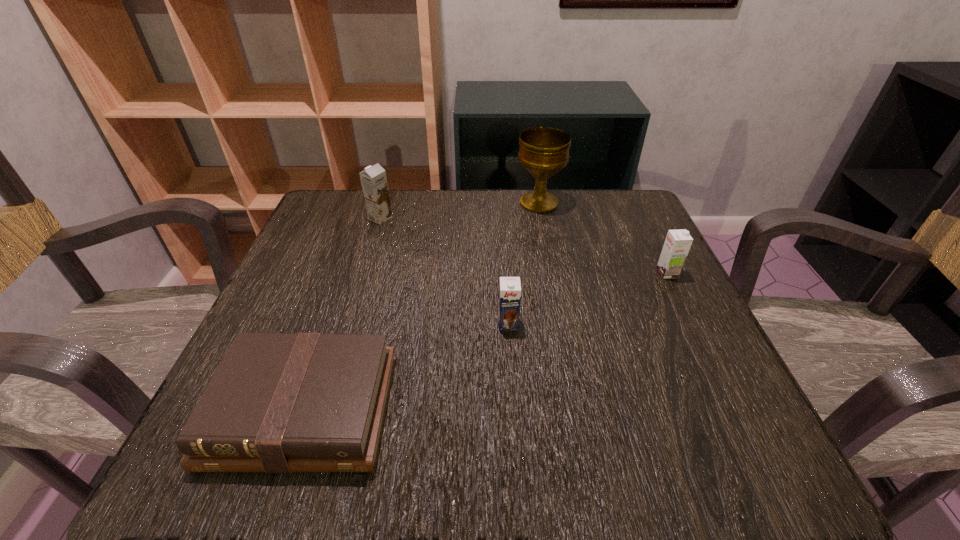
Image resolution: width=960 pixels, height=540 pixels. Identify the location of vacant area between the nearest chocolate milk and the rightmost chocolate milk. (588, 299).

You are a GUI agent. You are given a task and a screenshot of the screen. Output one action in this format:
    pyautogui.click(x=<x>, y=<y>)
    Task: Click on the free space between the leftmost chocolate milk and the rightmost object
    The height and width of the screenshot is (540, 960).
    Given the screenshot: What is the action you would take?
    pyautogui.click(x=523, y=246)

Where is `vacant area that lies between the fourth farthest object and the rightmost chocolate milk`? Image resolution: width=960 pixels, height=540 pixels. vacant area that lies between the fourth farthest object and the rightmost chocolate milk is located at coordinates click(588, 299).

In order to click on free area in between the nearest object and the rightmost object in this screenshot , I will do `click(486, 342)`.

At what (x,y) coordinates should I click in order to perform the action: click on free space between the rightmost chocolate milk and the second tallest object. Please return your answer as a coordinate pair (x, y). The width and height of the screenshot is (960, 540). Looking at the image, I should click on (523, 246).

I want to click on free spot between the second chocolate milk from left to right and the shortest object, so 406,367.

This screenshot has width=960, height=540. What are the coordinates of `free space between the leftmost chocolate milk and the nearest chocolate milk` in the screenshot? It's located at (444, 271).

The image size is (960, 540). I want to click on vacant area that lies between the second tallest object and the chalice, so click(460, 211).

Where is `free point between the rightmost chocolate milk and the fourth object from left to right`? Image resolution: width=960 pixels, height=540 pixels. free point between the rightmost chocolate milk and the fourth object from left to right is located at coordinates (603, 238).

Locate which object is the second closest to the second nearest object. Please provide its 2D coordinates. Your answer should be formatted as a tuple, i.e. [(x, y)], where the tuple contains the x and y coordinates of a point satisfying the conditions above.

[(678, 242)]